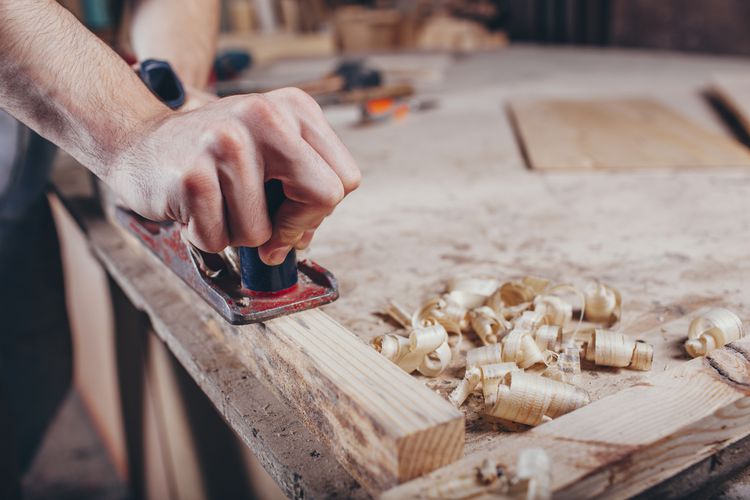
You are a GUI agent. You are given a task and a screenshot of the screen. Output one action in this format:
    pyautogui.click(x=<x>, y=<y>)
    Task: Click on the handle
    This screenshot has height=500, width=750.
    Given the screenshot: What is the action you would take?
    pyautogui.click(x=170, y=105)